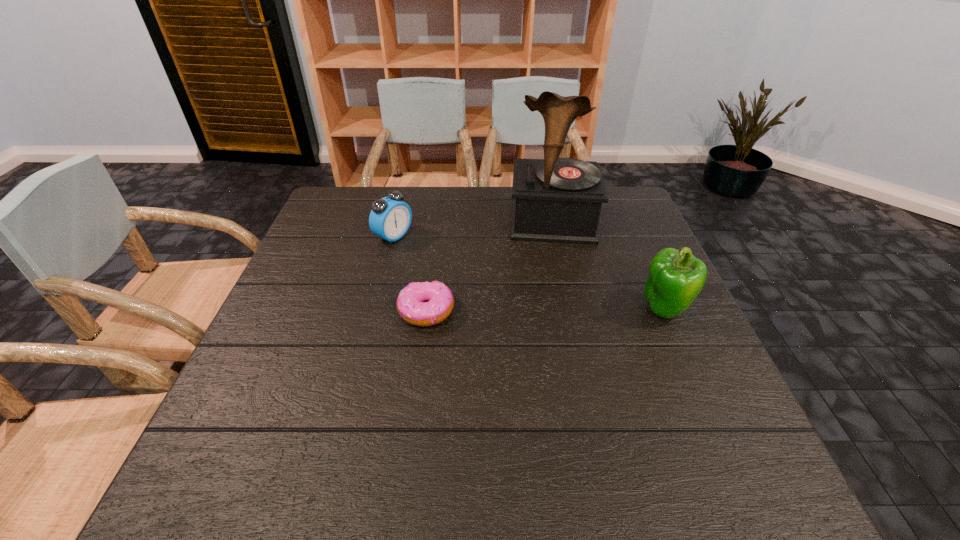
The width and height of the screenshot is (960, 540). I want to click on the shortest object, so click(422, 304).

The width and height of the screenshot is (960, 540). I want to click on bell pepper, so click(675, 278).

The image size is (960, 540). What are the coordinates of `the third shortest object` in the screenshot? It's located at 675,278.

You are a GUI agent. You are given a task and a screenshot of the screen. Output one action in this format:
    pyautogui.click(x=<x>, y=<y>)
    Task: Click on the alarm clock
    Image resolution: width=960 pixels, height=540 pixels.
    Given the screenshot: What is the action you would take?
    pyautogui.click(x=390, y=218)

Image resolution: width=960 pixels, height=540 pixels. What are the coordinates of `phonograph_record` in the screenshot? It's located at (559, 200).

At what (x,y) coordinates should I click in order to perform the action: click on the tallest object. Please return your answer as a coordinate pair (x, y). This screenshot has width=960, height=540. Looking at the image, I should click on (559, 200).

This screenshot has width=960, height=540. Find the location of `vacant point located on the right of the shortest object`. vacant point located on the right of the shortest object is located at coordinates [x=541, y=312].

Locate an element on the screen. Image resolution: width=960 pixels, height=540 pixels. vacant space situated on the left of the bell pepper is located at coordinates (511, 308).

Locate an element on the screen. vacant space located on the face of the alarm clock is located at coordinates (467, 275).

I want to click on vacant space located 0.060m on the face of the alarm clock, so click(423, 253).